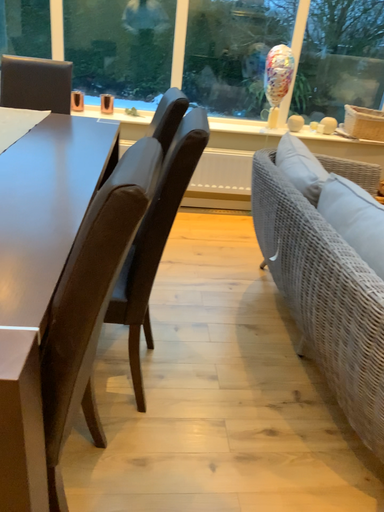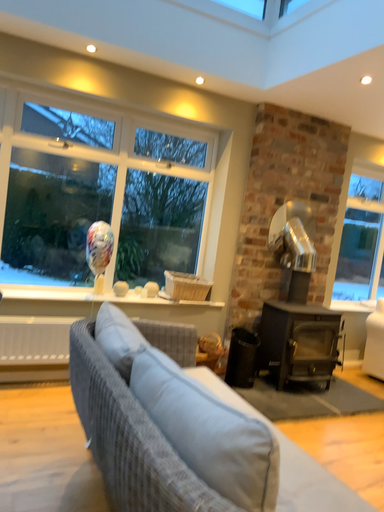
Question: Which way did the camera rotate in the video?

Choices:
 (A) rotated downward
 (B) rotated upward

Answer: (B)